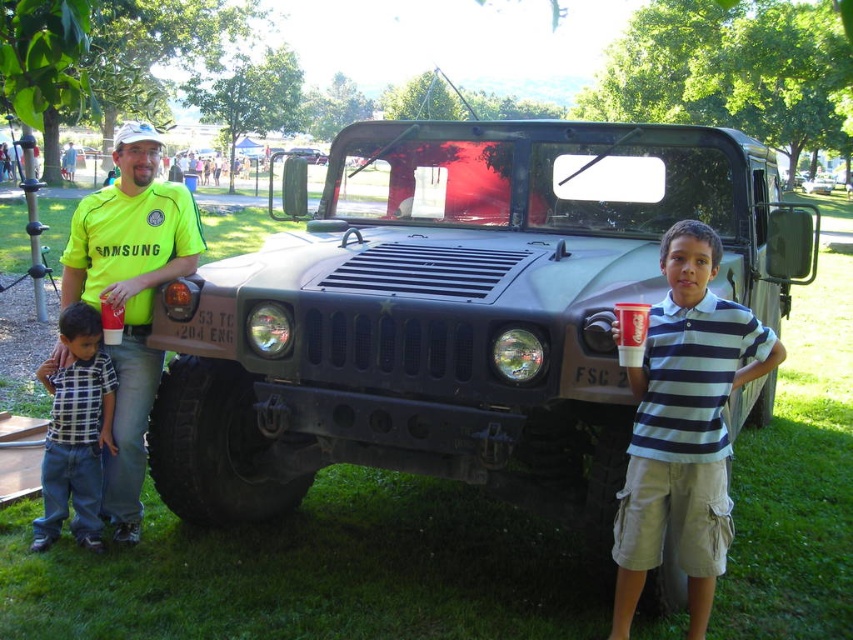
Does neon green jersey at left have a lesser height compared to metallic green military vehicle at center?

Correct, neon green jersey at left is not as tall as metallic green military vehicle at center.

Is point (177, 276) more distant than point (303, 157)?

No, it is in front of (303, 157).

Which is behind, point (119, 346) or point (283, 150)?

Positioned behind is point (283, 150).

I want to click on neon green jersey at left, so click(x=131, y=296).

Measure the distance between point [114,342] and camera.

Point [114,342] and camera are 4.06 meters apart.

Is point (129, 145) in front of point (90, 468)?

Yes, it is in front of point (90, 468).

Between point (157, 268) and point (61, 429), which one is positioned behind?

Point (157, 268)

You are a GUI agent. You are given a task and a screenshot of the screen. Output one action in this format:
    pyautogui.click(x=<x>, y=<y>)
    Task: Click on the neon green jersey at left
    
    Given the screenshot: What is the action you would take?
    click(x=131, y=296)

Can you confirm if striped cotton shirt at center is shorter than yellow fabric shirt at center?

Incorrect, striped cotton shirt at center's height does not fall short of yellow fabric shirt at center's.

Between striped cotton shirt at center and yellow fabric shirt at center, which one appears on the left side from the viewer's perspective?

Positioned to the left is yellow fabric shirt at center.

Does point (642, 538) come in front of point (70, 172)?

Yes, it is in front of point (70, 172).

The image size is (853, 640). What are the coordinates of `striped cotton shirt at center` in the screenshot? It's located at (683, 428).